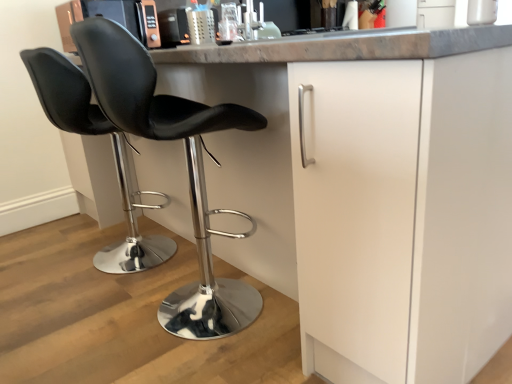
Identify the location of black leather stool at center, positioned as the 2th chair in left-to-right order. The width and height of the screenshot is (512, 384). (187, 166).

How much space does black leather stool at center, which appears as the 1th chair when viewed from the right, occupy vertically?

38.91 inches.

What do you see at coordinates (187, 166) in the screenshot? Image resolution: width=512 pixels, height=384 pixels. I see `black leather stool at center, positioned as the 2th chair in left-to-right order` at bounding box center [187, 166].

What do you see at coordinates (113, 152) in the screenshot? I see `black leather chair at center, arranged as the first chair when viewed from the left` at bounding box center [113, 152].

Locate an element on the screen. This screenshot has height=384, width=512. black leather chair at center, arranged as the first chair when viewed from the left is located at coordinates (x=113, y=152).

Find the location of a particular element. Image resolution: width=512 pixels, height=384 pixels. black leather stool at center, which appears as the 1th chair when viewed from the right is located at coordinates (187, 166).

Between black leather stool at center, which appears as the 1th chair when viewed from the right, and black leather chair at center, arranged as the first chair when viewed from the left, which one appears on the left side from the viewer's perspective?

black leather chair at center, arranged as the first chair when viewed from the left.

Is black leather stool at center, which appears as the 1th chair when viewed from the right, positioned before black leather chair at center, arranged as the first chair when viewed from the left?

Yes, it is in front of black leather chair at center, arranged as the first chair when viewed from the left.

Which point is more forward, (161, 137) or (95, 127)?

The point (161, 137) is closer to the camera.

From the image's perspective, which one is positioned lower, black leather stool at center, which appears as the 1th chair when viewed from the right, or black leather chair at center, the 2th chair when ordered from right to left?

black leather stool at center, which appears as the 1th chair when viewed from the right, is shown below in the image.

From a real-world perspective, is black leather stool at center, positioned as the 2th chair in left-to-right order, positioned under black leather chair at center, the 2th chair when ordered from right to left, based on gravity?

No, from a real-world perspective, black leather stool at center, positioned as the 2th chair in left-to-right order, is not below black leather chair at center, the 2th chair when ordered from right to left.

Between black leather stool at center, which appears as the 1th chair when viewed from the right, and black leather chair at center, the 2th chair when ordered from right to left, which one has larger width?

black leather stool at center, which appears as the 1th chair when viewed from the right.

Considering the relative sizes of black leather stool at center, positioned as the 2th chair in left-to-right order, and black leather chair at center, the 2th chair when ordered from right to left, in the image provided, is black leather stool at center, positioned as the 2th chair in left-to-right order, shorter than black leather chair at center, the 2th chair when ordered from right to left,?

No.

Considering the sizes of black leather stool at center, which appears as the 1th chair when viewed from the right, and black leather chair at center, arranged as the first chair when viewed from the left, in the image, is black leather stool at center, which appears as the 1th chair when viewed from the right, bigger or smaller than black leather chair at center, arranged as the first chair when viewed from the left,?

In the image, black leather stool at center, which appears as the 1th chair when viewed from the right, appears to be larger than black leather chair at center, arranged as the first chair when viewed from the left.

Is black leather stool at center, positioned as the 2th chair in left-to-right order, completely or partially outside of black leather chair at center, the 2th chair when ordered from right to left?

black leather stool at center, positioned as the 2th chair in left-to-right order, lies outside black leather chair at center, the 2th chair when ordered from right to left,'s area.

Is black leather stool at center, which appears as the 1th chair when viewed from the right, far from black leather chair at center, arranged as the first chair when viewed from the left?

No, black leather stool at center, which appears as the 1th chair when viewed from the right, is not far away from black leather chair at center, arranged as the first chair when viewed from the left.

Could you tell me if black leather stool at center, positioned as the 2th chair in left-to-right order, is facing black leather chair at center, the 2th chair when ordered from right to left?

No.

How different are the orientations of black leather stool at center, which appears as the 1th chair when viewed from the right, and black leather chair at center, arranged as the first chair when viewed from the left, in degrees?

black leather stool at center, which appears as the 1th chair when viewed from the right, and black leather chair at center, arranged as the first chair when viewed from the left, are facing 0.000135 degrees away from each other.

How far apart are black leather stool at center, positioned as the 2th chair in left-to-right order, and black leather chair at center, the 2th chair when ordered from right to left?

black leather stool at center, positioned as the 2th chair in left-to-right order, is 19.80 inches from black leather chair at center, the 2th chair when ordered from right to left.

The image size is (512, 384). In order to click on chair below the black leather stool at center, which appears as the 1th chair when viewed from the right (from a real-world perspective) in this screenshot , I will do `click(113, 152)`.

Which is more to the left, black leather chair at center, the 2th chair when ordered from right to left, or black leather stool at center, positioned as the 2th chair in left-to-right order?

black leather chair at center, the 2th chair when ordered from right to left.

Considering the positions of objects black leather chair at center, the 2th chair when ordered from right to left, and black leather stool at center, which appears as the 1th chair when viewed from the right, in the image provided, who is in front, black leather chair at center, the 2th chair when ordered from right to left, or black leather stool at center, which appears as the 1th chair when viewed from the right,?

black leather stool at center, which appears as the 1th chair when viewed from the right, is in front.

Considering the points (156, 240) and (220, 289), which point is in front, point (156, 240) or point (220, 289)?

Positioned in front is point (220, 289).

Based on the photo, from the image's perspective, between black leather chair at center, the 2th chair when ordered from right to left, and black leather stool at center, positioned as the 2th chair in left-to-right order, which one is located above?

black leather chair at center, the 2th chair when ordered from right to left, is shown above in the image.

From a real-world perspective, is black leather chair at center, arranged as the first chair when viewed from the left, positioned above or below black leather stool at center, positioned as the 2th chair in left-to-right order?

From a real-world perspective, black leather chair at center, arranged as the first chair when viewed from the left, is physically below black leather stool at center, positioned as the 2th chair in left-to-right order.

Considering the relative sizes of black leather chair at center, the 2th chair when ordered from right to left, and black leather stool at center, which appears as the 1th chair when viewed from the right, in the image provided, is black leather chair at center, the 2th chair when ordered from right to left, wider than black leather stool at center, which appears as the 1th chair when viewed from the right,?

No, black leather chair at center, the 2th chair when ordered from right to left, is not wider than black leather stool at center, which appears as the 1th chair when viewed from the right.

Is black leather chair at center, the 2th chair when ordered from right to left, taller than black leather stool at center, positioned as the 2th chair in left-to-right order?

Incorrect, the height of black leather chair at center, the 2th chair when ordered from right to left, is not larger of that of black leather stool at center, positioned as the 2th chair in left-to-right order.

Is black leather chair at center, the 2th chair when ordered from right to left, bigger than black leather stool at center, positioned as the 2th chair in left-to-right order?

Incorrect, black leather chair at center, the 2th chair when ordered from right to left, is not larger than black leather stool at center, positioned as the 2th chair in left-to-right order.

Is black leather chair at center, arranged as the first chair when viewed from the left, not inside black leather stool at center, which appears as the 1th chair when viewed from the right?

Yes.

Can you see black leather chair at center, arranged as the first chair when viewed from the left, touching black leather stool at center, which appears as the 1th chair when viewed from the right?

black leather chair at center, arranged as the first chair when viewed from the left, and black leather stool at center, which appears as the 1th chair when viewed from the right, are clearly separated.

Is black leather chair at center, the 2th chair when ordered from right to left, oriented towards black leather stool at center, positioned as the 2th chair in left-to-right order?

No, black leather chair at center, the 2th chair when ordered from right to left, does not turn towards black leather stool at center, positioned as the 2th chair in left-to-right order.

Measure the distance from black leather chair at center, the 2th chair when ordered from right to left, to black leather stool at center, which appears as the 1th chair when viewed from the right.

black leather chair at center, the 2th chair when ordered from right to left, and black leather stool at center, which appears as the 1th chair when viewed from the right, are 50.29 centimeters apart from each other.

You are a GUI agent. You are given a task and a screenshot of the screen. Output one action in this format:
    pyautogui.click(x=<x>, y=<y>)
    Task: Click on the chair on the right of black leather chair at center, the 2th chair when ordered from right to left
    This screenshot has height=384, width=512.
    Given the screenshot: What is the action you would take?
    (x=187, y=166)

At what (x,y) coordinates should I click in order to perform the action: click on chair located on the left of black leather stool at center, which appears as the 1th chair when viewed from the right. Please return your answer as a coordinate pair (x, y). Looking at the image, I should click on (113, 152).

The image size is (512, 384). What are the coordinates of `chair located above the black leather chair at center, arranged as the first chair when viewed from the left (from a real-world perspective)` in the screenshot? It's located at (187, 166).